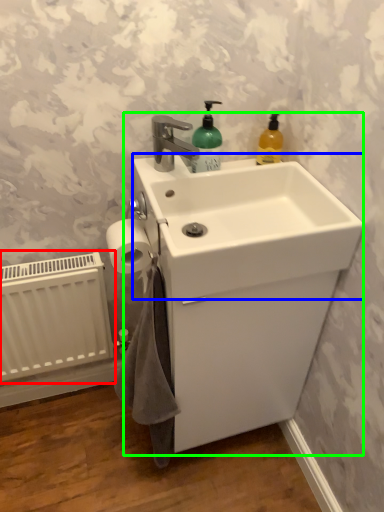
Question: Which object is positioned closest to radiator (highlighted by a red box)? Select from counter top (highlighted by a blue box) and sink (highlighted by a green box).

Choices:
 (A) counter top
 (B) sink

Answer: (B)